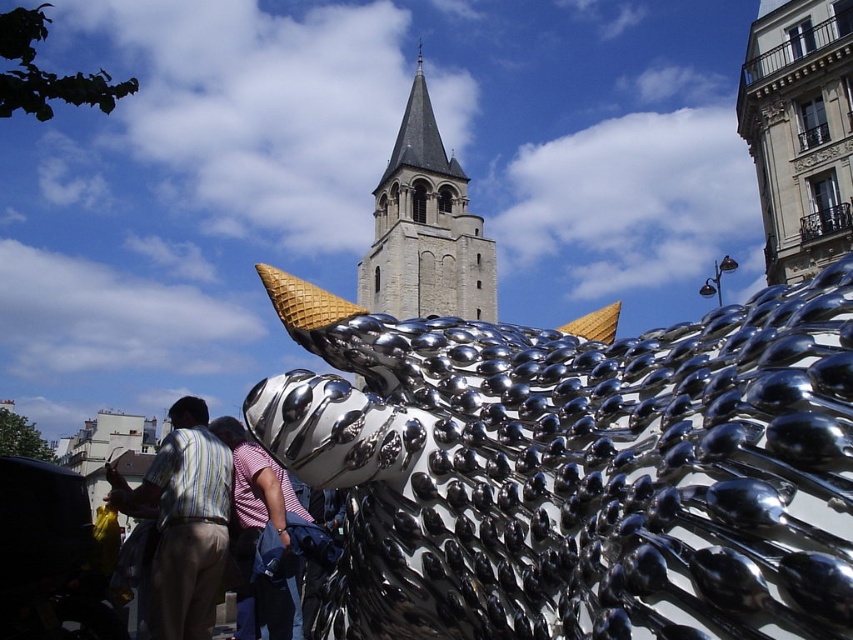
Question: Does striped fabric shirt at lower left appear on the right side of striped cotton shirt at center?

Choices:
 (A) yes
 (B) no

Answer: (B)

Question: Can you confirm if shiny metallic fish at center is thinner than striped fabric shirt at lower left?

Choices:
 (A) no
 (B) yes

Answer: (B)

Question: Which point appears closest to the camera in this image?

Choices:
 (A) coord(175,532)
 (B) coord(408,108)

Answer: (A)

Question: Which object is farther from the camera taking this photo?

Choices:
 (A) gray stone tower at center
 (B) striped cotton shirt at center
 (C) shiny metallic fish at center
 (D) striped fabric shirt at lower left

Answer: (A)

Question: Considering the real-world distances, which object is farthest from the shiny metallic fish at center?

Choices:
 (A) striped fabric shirt at lower left
 (B) gray stone tower at center

Answer: (B)

Question: Is gray stone tower at center bigger than striped cotton shirt at center?

Choices:
 (A) no
 (B) yes

Answer: (B)